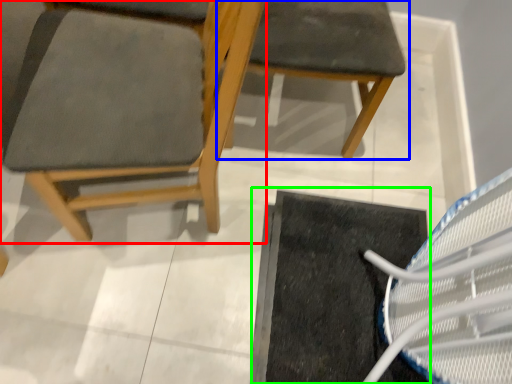
Question: Which object is the closest to the chair (highlighted by a red box)? Choose among these: chair (highlighted by a blue box) or doormat (highlighted by a green box).

Choices:
 (A) chair
 (B) doormat

Answer: (A)